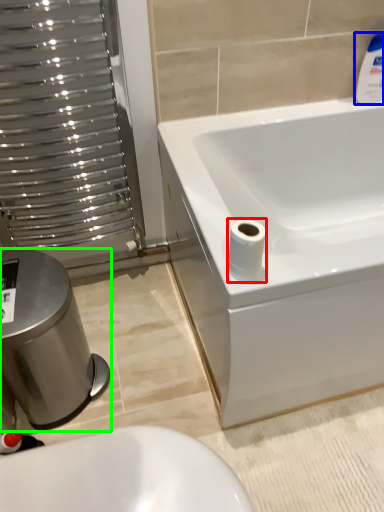
Question: Which object is positioned closest to toilet paper (highlighted by a red box)? Select from cleaning product (highlighted by a blue box) and bidet (highlighted by a green box).

Choices:
 (A) cleaning product
 (B) bidet

Answer: (B)